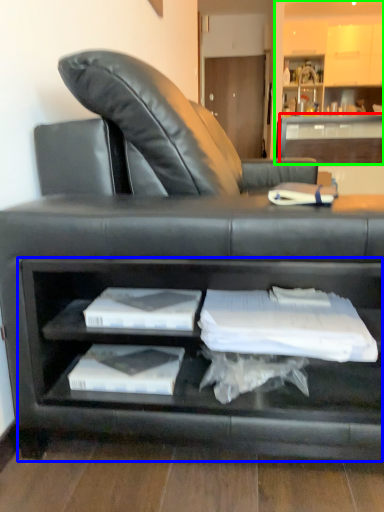
Question: Which object is positioned farthest from table (highlighted by a red box)? Select from cabinet (highlighted by a blue box) and entertainment center (highlighted by a green box).

Choices:
 (A) cabinet
 (B) entertainment center

Answer: (A)